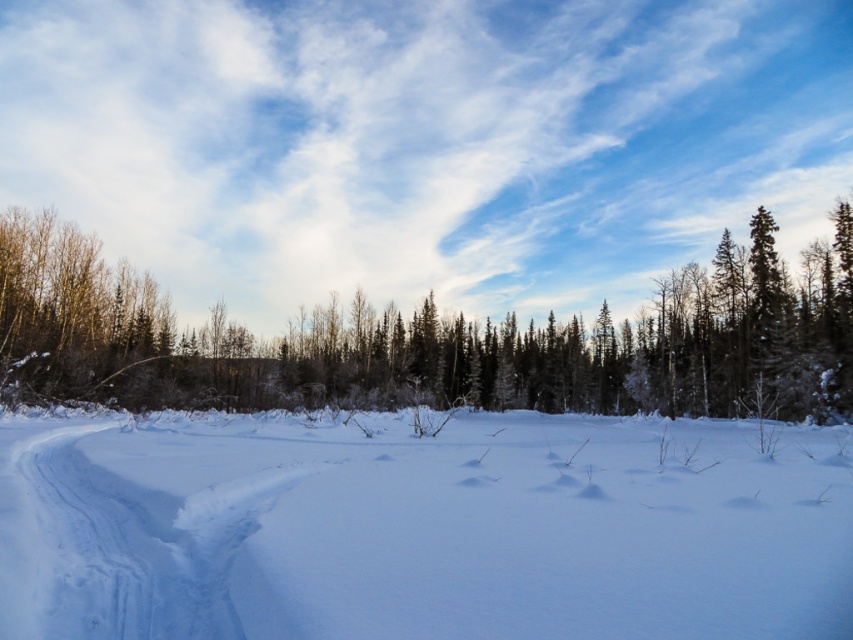
You are standing in the winter landscape and want to take a photo of the white fluffy snow at center and the snowy evergreen trees at center. Which object will appear closer to the camera in the photo?

The white fluffy snow at center will appear closer to the camera because it is positioned in front of the snowy evergreen trees at center.

You are an observer standing in the winter landscape. You notice the white fluffy snow at center and the snowy evergreen trees at center. Which one appears taller from your viewpoint?

The snowy evergreen trees at center are taller than the white fluffy snow at center.

You are standing in the winter landscape and want to place a small snowman exactly halfway between the point at coordinates point (90, 556) and point (131, 321). Will the snowman be closer to the camera or further away compared to both points?

The snowman placed halfway between point (90, 556) and point (131, 321) will be closer to the camera than both points because point (90, 556) is closer to the camera than point (131, 321).